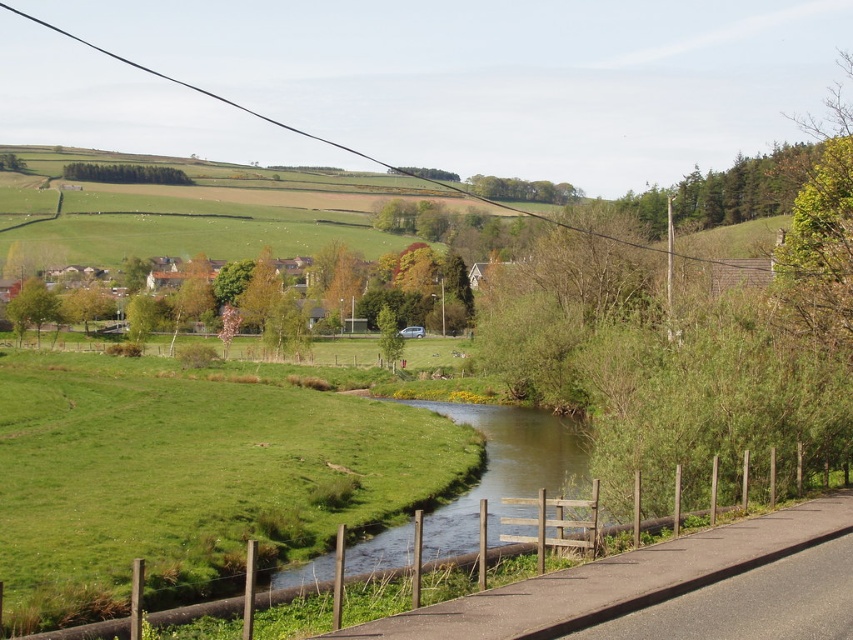
Question: Is green leafy trees at upper left smaller than green leafy tree at center-left?

Choices:
 (A) no
 (B) yes

Answer: (A)

Question: Which of the following is the farthest from the observer?

Choices:
 (A) green leafy tree at center-left
 (B) green leafy trees at upper left
 (C) green grassy stream at center
 (D) green leafy tree at upper left

Answer: (D)

Question: Observing the image, what is the correct spatial positioning of green leafy trees at upper left in reference to green leafy tree at upper left?

Choices:
 (A) above
 (B) below

Answer: (B)

Question: Among these objects, which one is nearest to the camera?

Choices:
 (A) green grassy stream at center
 (B) green leafy trees at upper left

Answer: (A)

Question: Can you confirm if green grassy stream at center is positioned to the left of green leafy tree at center?

Choices:
 (A) no
 (B) yes

Answer: (A)

Question: Which object appears farthest from the camera in this image?

Choices:
 (A) green grassy stream at center
 (B) green leafy tree at upper left
 (C) green leafy trees at upper left
 (D) green leafy tree at center

Answer: (B)